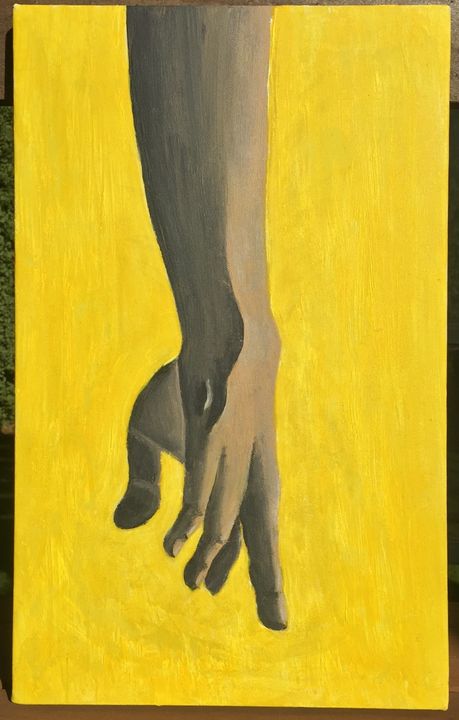
Where is `painting`? painting is located at coordinates (195, 220).